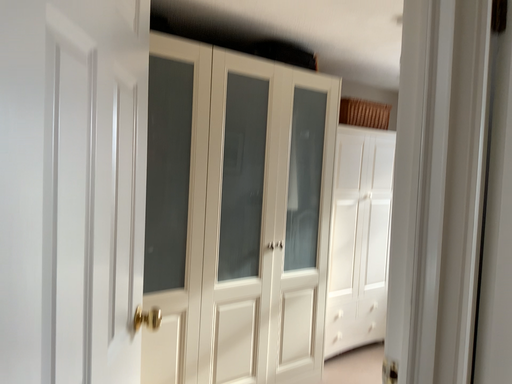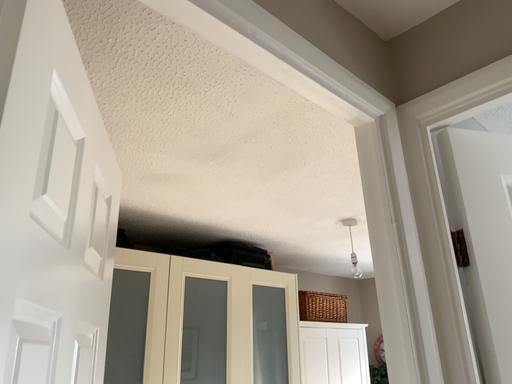
Question: How did the camera likely rotate when shooting the video?

Choices:
 (A) rotated downward
 (B) rotated upward

Answer: (B)